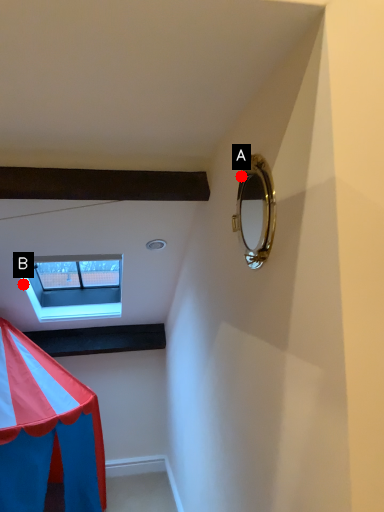
Question: Two points are circled on the image, labeled by A and B beside each circle. Which point is farther to the camera?

Choices:
 (A) A is further
 (B) B is further

Answer: (B)